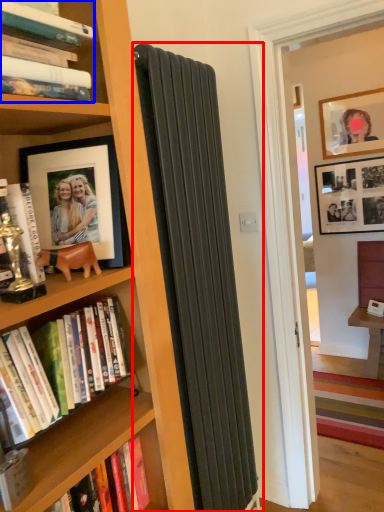
Question: Which point is closer to the camera, curtain (highlighted by a red box) or book (highlighted by a blue box)?

Choices:
 (A) curtain
 (B) book

Answer: (B)